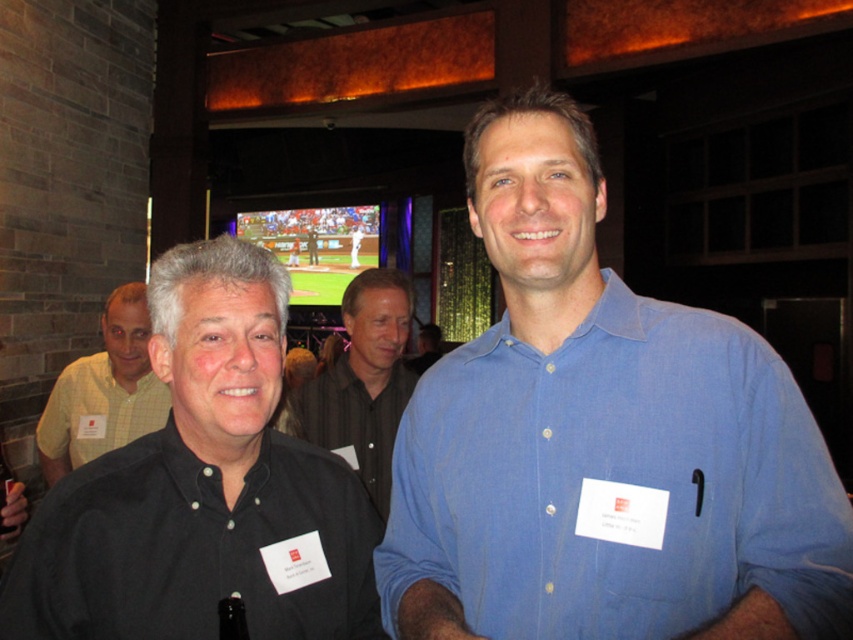
You are at a social event and want to take a photo of the two men standing near the brick wall. You are currently at point marked as point (329, 556). If your camera has a minimum focusing distance of 1 meter, will you be able to take a clear photo of them?

The distance between point (329, 556) and the camera is 1.12 meters, which is greater than the camera minimum focusing distance of 1 meter. Therefore, you can take a clear photo of them.

In the scene shown: You are organizing a charity event and need to arrange two shirts for a display. The blue cotton shirt at center and the black matte shirt at center are available. If you want to place them side by side on a narrow shelf, which shirt should you choose to ensure it fits better?

The blue cotton shirt at center occupies less space than the black matte shirt at center, so it would fit better on the narrow shelf.

You are organizing a photo shoot and need to arrange the two men so that their shirts take up equal space in the frame. Given that the blue cotton shirt at center and the black shirt at center currently occupy different amounts of space, which shirt should you adjust to make them equal?

The blue cotton shirt at center occupies less space than the black shirt at center. To make them equal, you should adjust the blue cotton shirt at center to take up more space or reduce the space occupied by the black shirt at center.